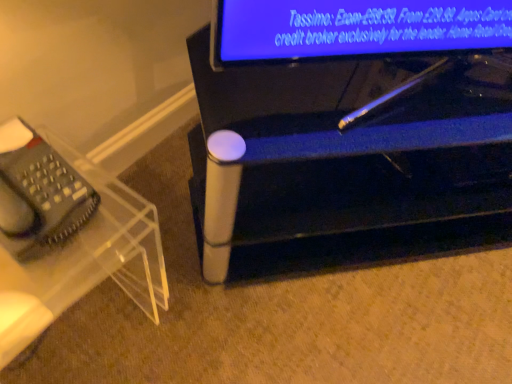
Locate an element on the screen. Image resolution: width=512 pixels, height=384 pixels. free space between metallic silver pen at lower center, marked as the second furniture in a left-to-right arrangement, and transparent acrylic phone stand at left, the 1th furniture in the left-to-right sequence is located at coordinates (260, 292).